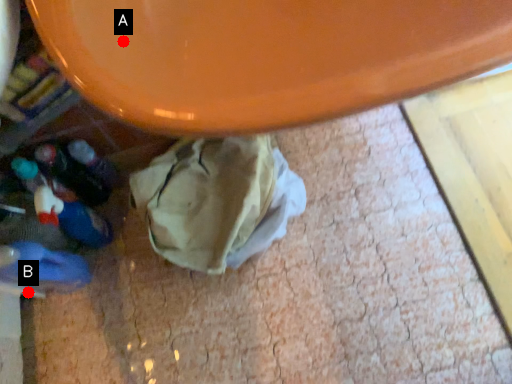
Question: Two points are circled on the image, labeled by A and B beside each circle. Which point is closer to the camera?

Choices:
 (A) A is closer
 (B) B is closer

Answer: (A)